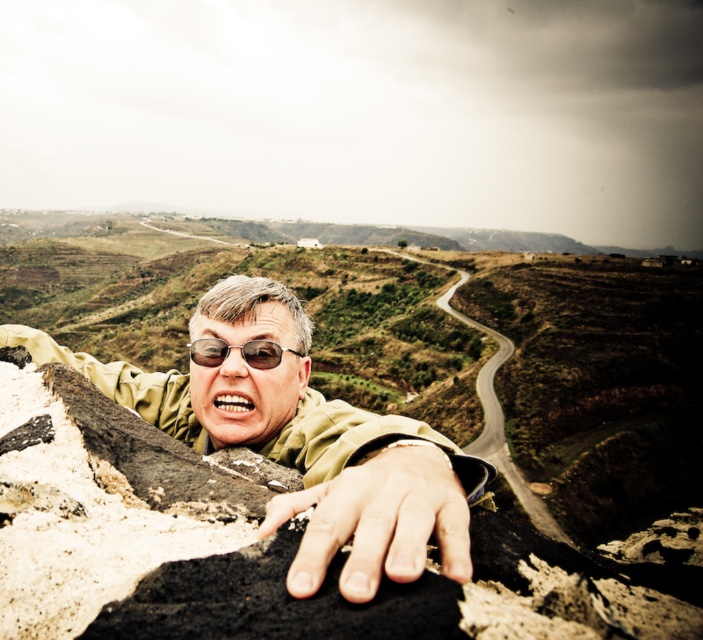
You are a photographer trying to capture the person in the scene. The matte green jacket at center and sunglasses at center are both important elements. Which object should you focus on first to ensure it appears sharp in the photo?

The matte green jacket at center is in front of sunglasses at center, so focusing on the matte green jacket at center first will ensure both elements are sharp since the sunglasses at center is behind it.

You are a photographer planning to take a picture of the scene. The matte green jacket at center and the smooth stone hand at center are crucial elements. Based on their positions, which object should you focus on first to ensure both are in sharp focus?

The smooth stone hand at center is located below the matte green jacket at center. To ensure both are in sharp focus, you should focus on the smooth stone hand at center first since it is closer to the camera.